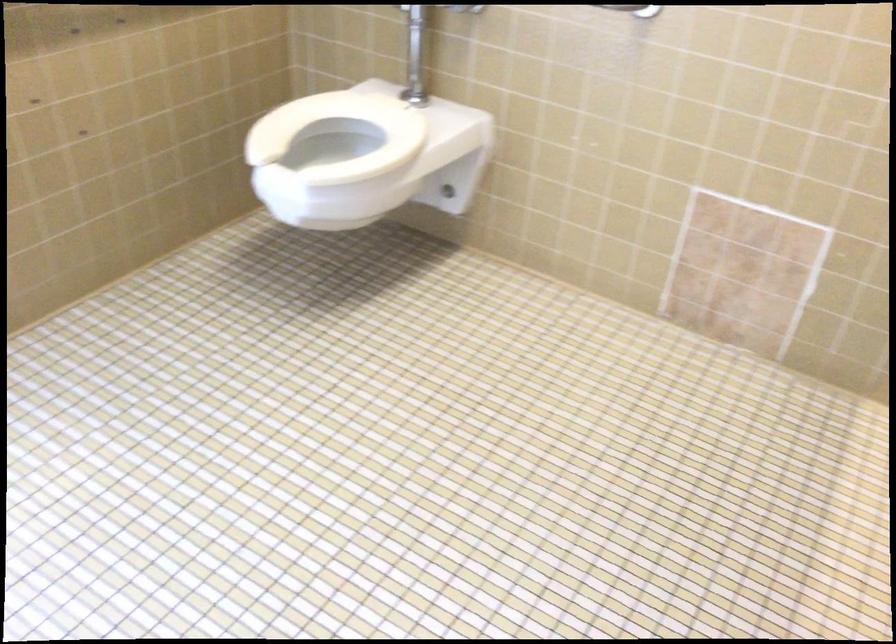
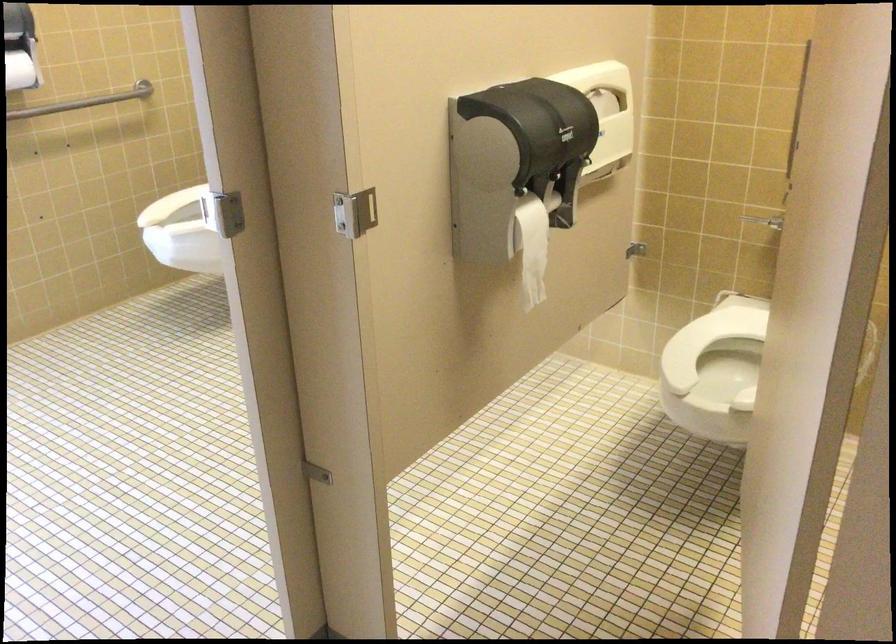
Question: I am providing you with two images of the same scene from different viewpoints. Please identify which objects are invisible in image2.

Choices:
 (A) stall door latch
 (B) yellow bananas
 (C) metal grab bar
 (D) toilet flush handle

Answer: (C)